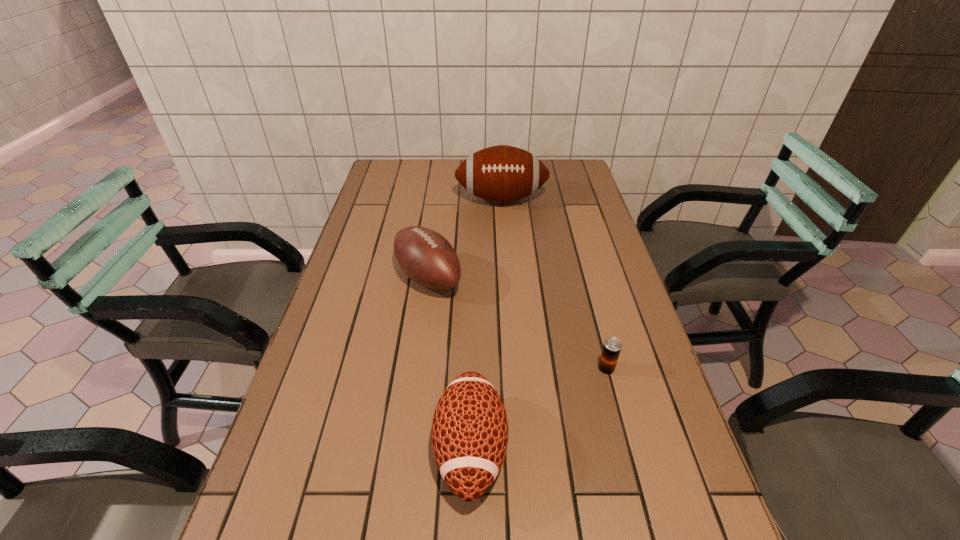
Locate an element on the screen. object that is at the far edge is located at coordinates (502, 173).

Where is `object situated at the right edge`? object situated at the right edge is located at coordinates (612, 346).

I want to click on free space at the left edge, so click(x=372, y=248).

Locate an element on the screen. The height and width of the screenshot is (540, 960). vacant space at the right edge is located at coordinates (637, 478).

The width and height of the screenshot is (960, 540). What are the coordinates of `blank space at the far right corner of the desktop` in the screenshot? It's located at (561, 161).

Locate an element on the screen. The width and height of the screenshot is (960, 540). blank region between the nearest object and the farthest football is located at coordinates (486, 324).

This screenshot has height=540, width=960. What are the coordinates of `vacant point located between the tallest object and the second nearest football` in the screenshot? It's located at (465, 238).

Image resolution: width=960 pixels, height=540 pixels. I want to click on free spot between the beer can and the second nearest football, so click(517, 323).

Where is `free spot between the second nearest football and the nearest football`? This screenshot has height=540, width=960. free spot between the second nearest football and the nearest football is located at coordinates (449, 363).

Where is `vacant area between the third nearest object and the farthest object`? This screenshot has width=960, height=540. vacant area between the third nearest object and the farthest object is located at coordinates (465, 238).